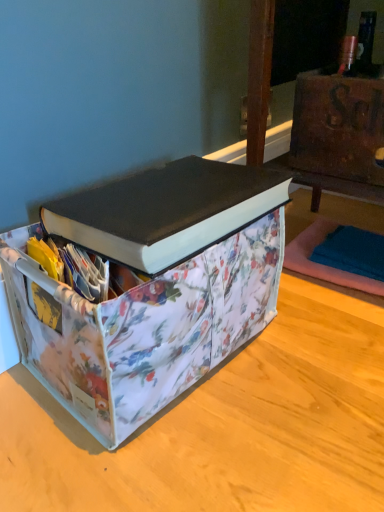
This screenshot has width=384, height=512. I want to click on floral fabric storage bin at center, so click(x=150, y=288).

This screenshot has height=512, width=384. What do you see at coordinates (259, 76) in the screenshot? I see `floral fabric storage bin at lower right` at bounding box center [259, 76].

What do you see at coordinates (166, 211) in the screenshot?
I see `black matte book at upper center` at bounding box center [166, 211].

Image resolution: width=384 pixels, height=512 pixels. What are the coordinates of `floral fabric storage bin at center` in the screenshot? It's located at (150, 288).

Which object is positioned more to the left, black matte book at upper center or teal fabric yoga mat at lower right?

Positioned to the left is black matte book at upper center.

How many degrees apart are the facing directions of black matte book at upper center and teal fabric yoga mat at lower right?

84.9 degrees.

Do you think black matte book at upper center is within teal fabric yoga mat at lower right, or outside of it?

black matte book at upper center is located beyond the bounds of teal fabric yoga mat at lower right.

Which is in front, point (260, 207) or point (88, 220)?

The point (88, 220) is more forward.

Is the surface of black matte book at upper center in direct contact with floral fabric storage bin at center?

Indeed, black matte book at upper center and floral fabric storage bin at center are beside each other and touching.

This screenshot has height=512, width=384. Find the location of `book located on the right of floral fabric storage bin at center`. book located on the right of floral fabric storage bin at center is located at coordinates (166, 211).

Is teal fabric yoga mat at lower right beside floral fabric storage bin at lower right?

No, teal fabric yoga mat at lower right is not next to floral fabric storage bin at lower right.

From a real-world perspective, between teal fabric yoga mat at lower right and floral fabric storage bin at lower right, who is vertically lower?

From a 3D spatial view, teal fabric yoga mat at lower right is below.

Does teal fabric yoga mat at lower right have a greater height compared to floral fabric storage bin at lower right?

Incorrect, the height of teal fabric yoga mat at lower right is not larger of that of floral fabric storage bin at lower right.

Considering the sizes of objects teal fabric yoga mat at lower right and floral fabric storage bin at lower right in the image provided, who is smaller, teal fabric yoga mat at lower right or floral fabric storage bin at lower right?

Smaller between the two is teal fabric yoga mat at lower right.

Which is correct: floral fabric storage bin at lower right is inside floral fabric storage bin at center, or outside of it?

floral fabric storage bin at lower right is not inside floral fabric storage bin at center, it's outside.

What are the coordinates of `furniture above the floral fabric storage bin at center (from a real-world perspective)` in the screenshot? It's located at pyautogui.click(x=259, y=76).

Which object is positioned more to the left, floral fabric storage bin at lower right or floral fabric storage bin at center?

floral fabric storage bin at center.

Is floral fabric storage bin at lower right taller than floral fabric storage bin at center?

Indeed, floral fabric storage bin at lower right has a greater height compared to floral fabric storage bin at center.

Is black matte book at upper center next to rusty metal chest at upper right and touching it?

No, black matte book at upper center is not in contact with rusty metal chest at upper right.

Locate an element on the screen. cardboard box above the black matte book at upper center (from the image's perspective) is located at coordinates (338, 125).

Is point (102, 206) farther from viewer compared to point (313, 143)?

No, (102, 206) is in front of (313, 143).

Is teal fabric yoga mat at lower right closer to the viewer compared to rusty metal chest at upper right?

That is True.

Is rusty metal chest at upper right at the back of teal fabric yoga mat at lower right?

teal fabric yoga mat at lower right does not have its back to rusty metal chest at upper right.

Is teal fabric yoga mat at lower right directly adjacent to rusty metal chest at upper right?

There is a gap between teal fabric yoga mat at lower right and rusty metal chest at upper right.

Can you confirm if teal fabric yoga mat at lower right is smaller than rusty metal chest at upper right?

Incorrect, teal fabric yoga mat at lower right is not smaller in size than rusty metal chest at upper right.

The height and width of the screenshot is (512, 384). Find the location of `book below the rusty metal chest at upper right (from the image's perspective)`. book below the rusty metal chest at upper right (from the image's perspective) is located at coordinates (166, 211).

From the image's perspective, would you say rusty metal chest at upper right is positioned over black matte book at upper center?

Yes, from the image's perspective, rusty metal chest at upper right is above black matte book at upper center.

From a real-world perspective, between rusty metal chest at upper right and black matte book at upper center, who is vertically higher?

rusty metal chest at upper right, from a real-world perspective.

From the picture: Is rusty metal chest at upper right surrounding black matte book at upper center?

No, black matte book at upper center is located outside of rusty metal chest at upper right.

The image size is (384, 512). Identify the location of book in front of the teal fabric yoga mat at lower right. (166, 211).

I want to click on box on the left of black matte book at upper center, so click(150, 288).

Looking at the image, which one is located closer to rusty metal chest at upper right, black matte book at upper center or teal fabric yoga mat at lower right?

teal fabric yoga mat at lower right is closer to rusty metal chest at upper right.

Which object lies further to the anchor point black matte book at upper center, floral fabric storage bin at center or rusty metal chest at upper right?

rusty metal chest at upper right lies further to black matte book at upper center than the other object.

When comparing their distances from rusty metal chest at upper right, does floral fabric storage bin at center or floral fabric storage bin at lower right seem closer?

floral fabric storage bin at lower right is closer to rusty metal chest at upper right.

Looking at the image, which one is located further to floral fabric storage bin at lower right, floral fabric storage bin at center or rusty metal chest at upper right?

floral fabric storage bin at center is further to floral fabric storage bin at lower right.

Looking at this image, based on their spatial positions, is floral fabric storage bin at center or teal fabric yoga mat at lower right closer to black matte book at upper center?

floral fabric storage bin at center is closer to black matte book at upper center.

Which object lies nearer to the anchor point black matte book at upper center, floral fabric storage bin at center or floral fabric storage bin at lower right?

floral fabric storage bin at center.

When comparing their distances from floral fabric storage bin at lower right, does floral fabric storage bin at center or teal fabric yoga mat at lower right seem further?

floral fabric storage bin at center lies further to floral fabric storage bin at lower right than the other object.

When comparing their distances from teal fabric yoga mat at lower right, does rusty metal chest at upper right or floral fabric storage bin at lower right seem closer?

Based on the image, floral fabric storage bin at lower right appears to be nearer to teal fabric yoga mat at lower right.

The width and height of the screenshot is (384, 512). What are the coordinates of `cardboard box between black matte book at upper center and floral fabric storage bin at lower right in the horizontal direction` in the screenshot? It's located at (338, 125).

Locate an element on the screen. cardboard box between black matte book at upper center and teal fabric yoga mat at lower right from left to right is located at coordinates (338, 125).

Find the location of a particular element. book situated between floral fabric storage bin at center and floral fabric storage bin at lower right from left to right is located at coordinates (166, 211).

The width and height of the screenshot is (384, 512). What are the coordinates of `furniture between rusty metal chest at upper right and teal fabric yoga mat at lower right in the vertical direction` in the screenshot? It's located at (259, 76).